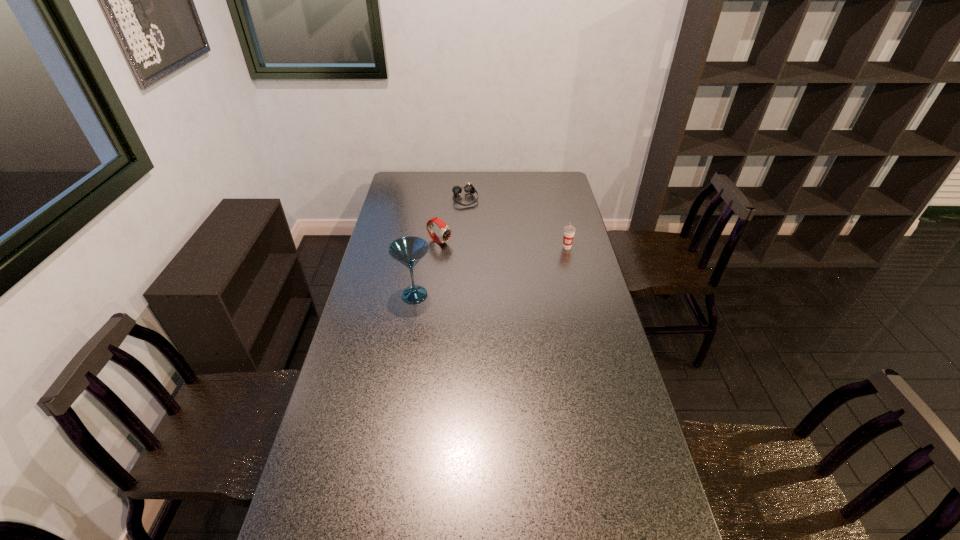
Image resolution: width=960 pixels, height=540 pixels. I want to click on the tallest object, so click(x=408, y=251).

At what (x,y) coordinates should I click in order to perform the action: click on the nearest object. Please return your answer as a coordinate pair (x, y). Looking at the image, I should click on (408, 251).

You are a GUI agent. You are given a task and a screenshot of the screen. Output one action in this format:
    pyautogui.click(x=<x>, y=<y>)
    Task: Click on the cup
    The width and height of the screenshot is (960, 540).
    Given the screenshot: What is the action you would take?
    pyautogui.click(x=569, y=231)

I want to click on the third shortest object, so click(569, 231).

The width and height of the screenshot is (960, 540). Identify the location of the shortest object. pyautogui.click(x=468, y=188).

This screenshot has height=540, width=960. What are the coordinates of `the farthest object` in the screenshot? It's located at (468, 188).

You are a GUI agent. You are given a task and a screenshot of the screen. Output one action in this format:
    pyautogui.click(x=<x>, y=<y>)
    Task: Click on the watch
    
    Given the screenshot: What is the action you would take?
    pyautogui.click(x=445, y=233)

You are a GUI agent. You are given a task and a screenshot of the screen. Output one action in this format:
    pyautogui.click(x=<x>, y=<y>)
    Task: Click on the free space located 0.060m on the left of the tallest object
    The image size is (960, 540).
    Given the screenshot: What is the action you would take?
    pyautogui.click(x=380, y=295)

At what (x,y) coordinates should I click in order to perform the action: click on vacant region located 0.150m on the side of the cup with the logo. Please return your answer as a coordinate pair (x, y). Image resolution: width=960 pixels, height=540 pixels. Looking at the image, I should click on (573, 273).

Find the location of `vacant space situated through the lenses of the shortest object`. vacant space situated through the lenses of the shortest object is located at coordinates (473, 216).